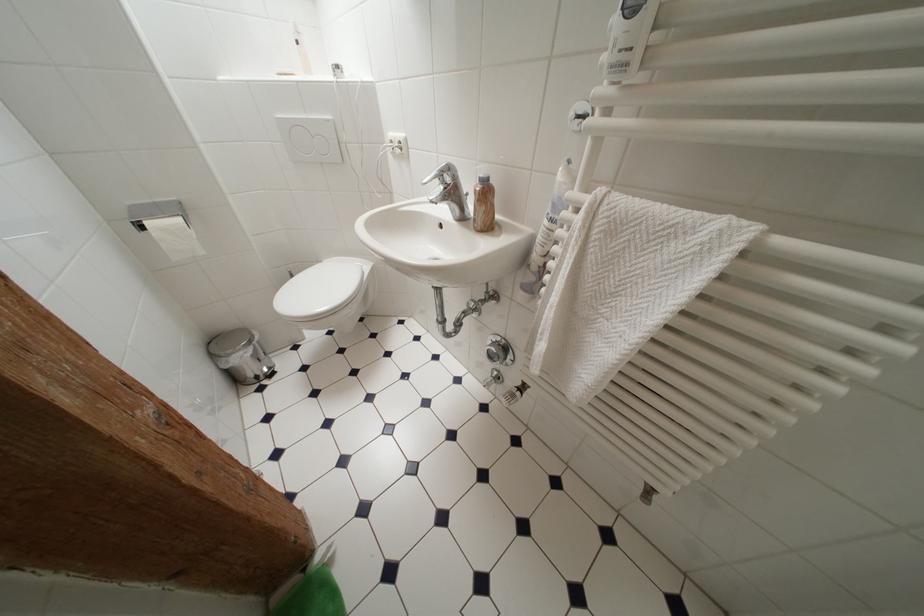
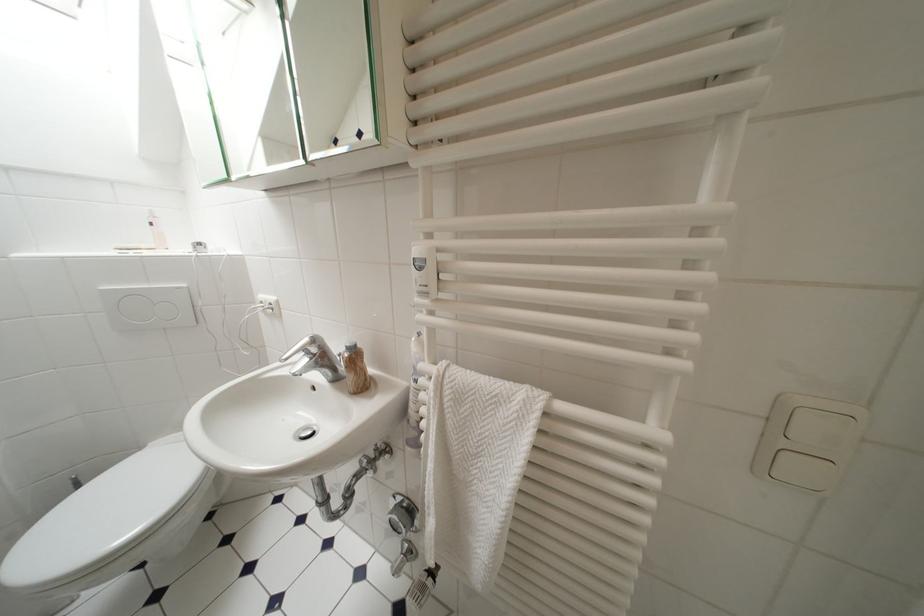
The point at [488,179] is marked in the first image. Where is the corresponding point in the second image?

(355, 347)